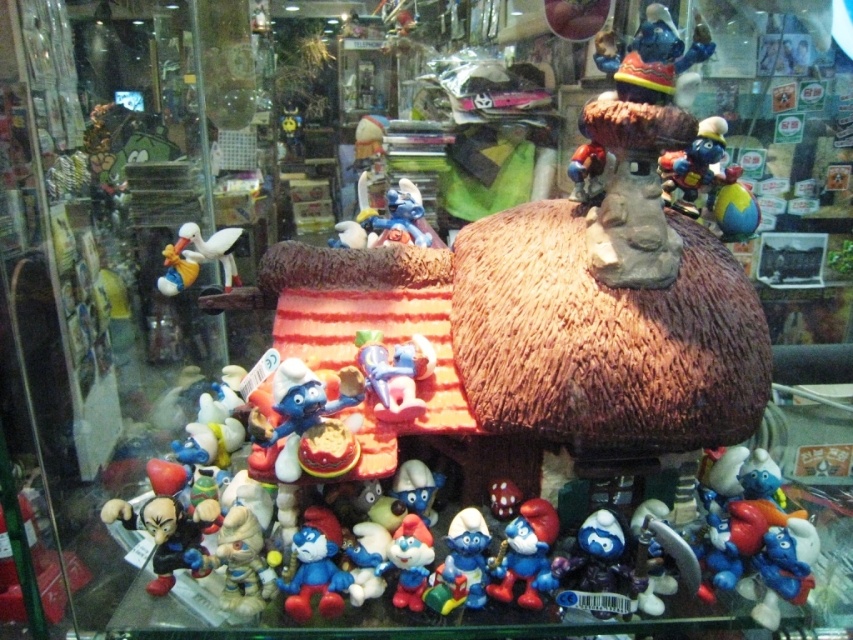
Is matte blue plastic smurf at lower center wider than blue glossy figurine at center?

Yes, matte blue plastic smurf at lower center is wider than blue glossy figurine at center.

Which is in front, point (526, 582) or point (454, 582)?

Point (454, 582)

Does point (543, 522) come in front of point (486, 538)?

No, (543, 522) is behind (486, 538).

What are the coordinates of `matte blue plastic smurf at lower center` in the screenshot? It's located at (525, 554).

Is matte plastic smurf at center positioned at the back of shiny metallic figurine at upper right?

That is False.

Is matte plastic smurf at center wider than shiny metallic figurine at upper right?

No, matte plastic smurf at center is not wider than shiny metallic figurine at upper right.

Is point (403, 419) positioned after point (717, 122)?

That is False.

Image resolution: width=853 pixels, height=640 pixels. I want to click on matte plastic smurf at center, so click(393, 372).

Does white glossy stork at left lie in front of smooth blue figurine at center?

No, white glossy stork at left is behind smooth blue figurine at center.

Who is more distant from viewer, (227, 257) or (398, 525)?

The point (227, 257) is more distant.

This screenshot has width=853, height=640. Identify the location of white glossy stork at left. (196, 257).